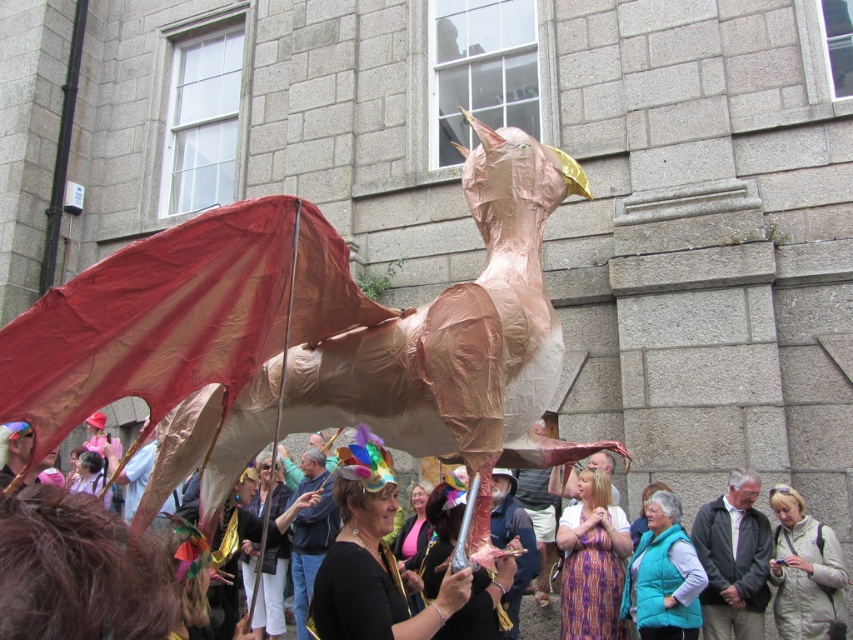
Does matte gold dragon at center have a lesser width compared to gray fabric jacket at center?

Incorrect, matte gold dragon at center's width is not less than gray fabric jacket at center's.

Consider the image. Can you confirm if matte gold dragon at center is wider than gray fabric jacket at center?

Correct, the width of matte gold dragon at center exceeds that of gray fabric jacket at center.

Who is more distant from viewer, (x=703, y=451) or (x=755, y=602)?

Point (x=703, y=451)

You are a GUI agent. You are given a task and a screenshot of the screen. Output one action in this format:
    pyautogui.click(x=<x>, y=<y>)
    Task: Click on the matte gold dragon at center
    
    Given the screenshot: What is the action you would take?
    (822, 465)

How far apart are printed fabric dress at center and light beige jacket at center?

6.12 meters

Can you confirm if printed fabric dress at center is positioned to the right of light beige jacket at center?

In fact, printed fabric dress at center is to the left of light beige jacket at center.

Locate an element on the screen. The height and width of the screenshot is (640, 853). printed fabric dress at center is located at coordinates (592, 561).

What do you see at coordinates (822, 465) in the screenshot?
I see `matte gold dragon at center` at bounding box center [822, 465].

Is matte gold dragon at center positioned behind light beige jacket at center?

Yes.

You are a GUI agent. You are given a task and a screenshot of the screen. Output one action in this format:
    pyautogui.click(x=<x>, y=<y>)
    Task: Click on the matte gold dragon at center
    
    Given the screenshot: What is the action you would take?
    pyautogui.click(x=822, y=465)